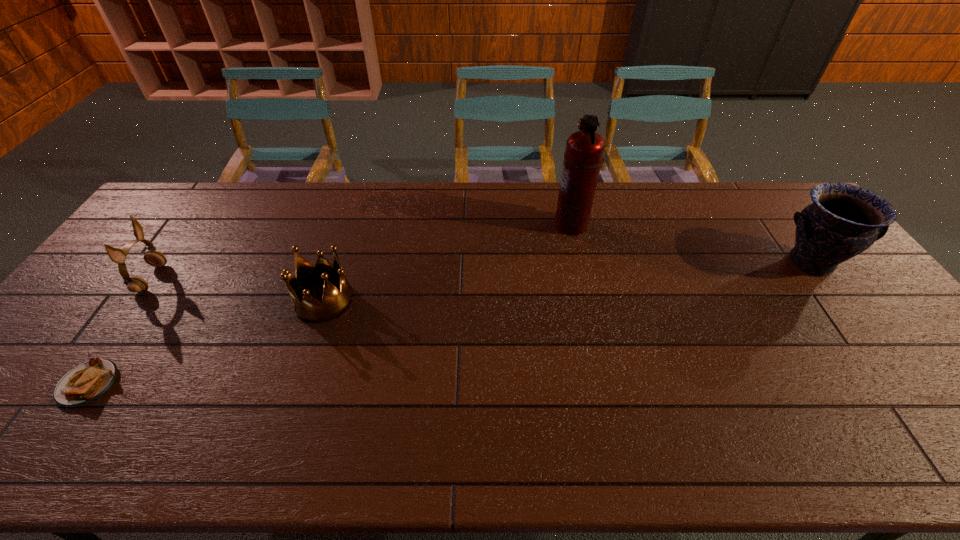
Locate an element on the screen. This screenshot has height=540, width=960. free spot at the far edge of the desktop is located at coordinates (658, 219).

Where is `free space at the near edge of the desktop`? The height and width of the screenshot is (540, 960). free space at the near edge of the desktop is located at coordinates (198, 458).

Locate an element on the screen. free region at the right edge of the desktop is located at coordinates (853, 336).

You are a GUI agent. You are given a task and a screenshot of the screen. Output one action in this format:
    pyautogui.click(x=<x>, y=<y>)
    Task: Click on the free spot between the fourth tallest object and the second object from right to left
    
    Given the screenshot: What is the action you would take?
    pyautogui.click(x=447, y=262)

Where is `vacant space in between the shortest object and the second shortest object`? vacant space in between the shortest object and the second shortest object is located at coordinates (206, 342).

The image size is (960, 540). I want to click on free space that is in between the pottery and the nearest object, so click(x=449, y=323).

Locate an element on the screen. free space between the earphone and the fire extinguisher is located at coordinates (361, 252).

At what (x,y) coordinates should I click in order to perform the action: click on free spot between the rightmost object and the fire extinguisher. Please return your answer as a coordinate pair (x, y). The height and width of the screenshot is (540, 960). Looking at the image, I should click on pyautogui.click(x=690, y=244).

The width and height of the screenshot is (960, 540). In order to click on free space between the third shortest object and the tallest object in this screenshot , I will do `click(361, 252)`.

I want to click on vacant space in between the earphone and the nearest object, so click(120, 331).